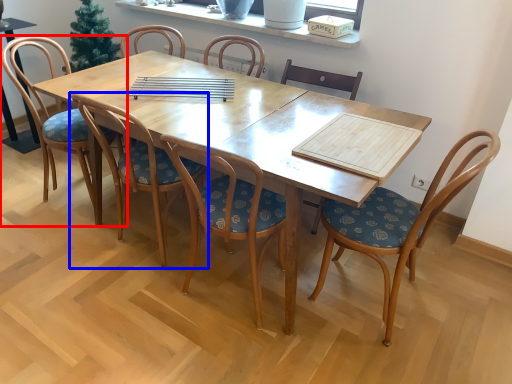
Question: Which point is closer to the camera, chair (highlighted by a red box) or chair (highlighted by a blue box)?

Choices:
 (A) chair
 (B) chair

Answer: (B)